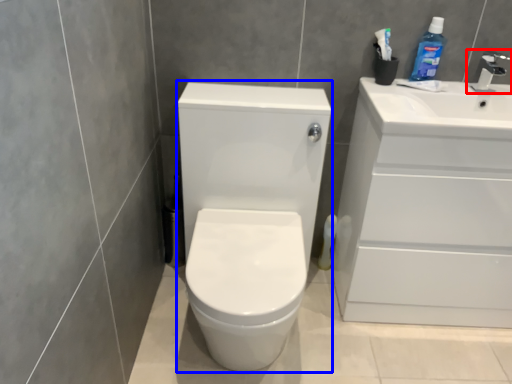
Question: Which object appears closest to the camera in this image, tap (highlighted by a red box) or porcelain (highlighted by a blue box)?

Choices:
 (A) tap
 (B) porcelain

Answer: (B)